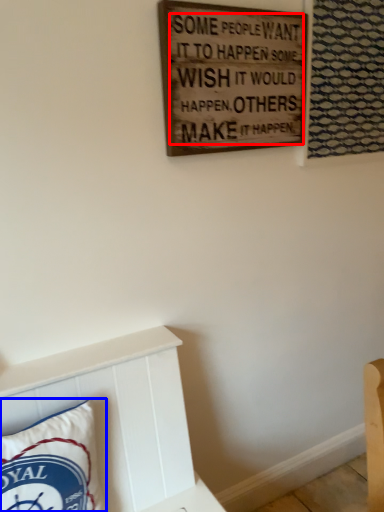
Question: Which point is further to the camera, writing (highlighted by a red box) or pillow (highlighted by a blue box)?

Choices:
 (A) writing
 (B) pillow

Answer: (A)